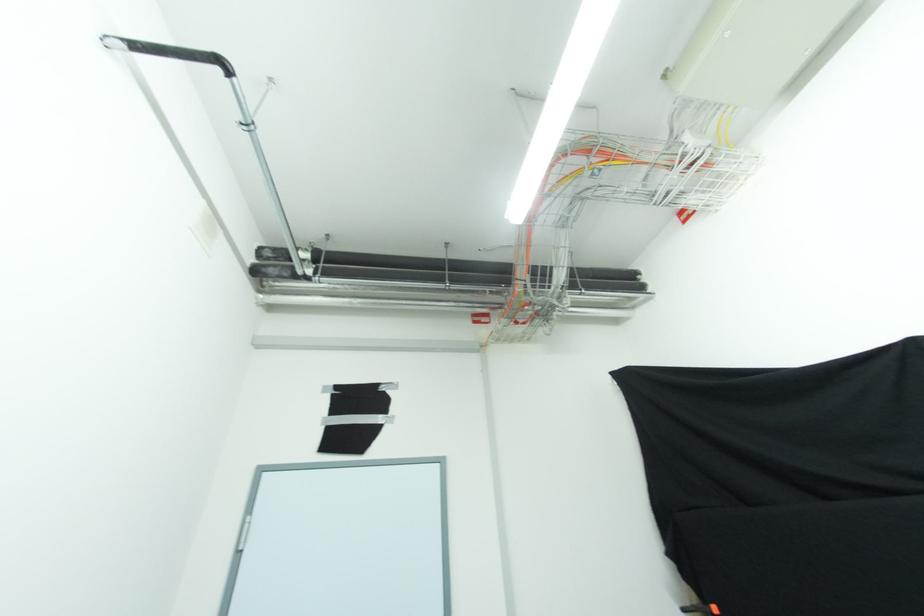
Find where to pull the black bar handle. Please return your answer as a coordinate pair (x, y).

(169, 52)